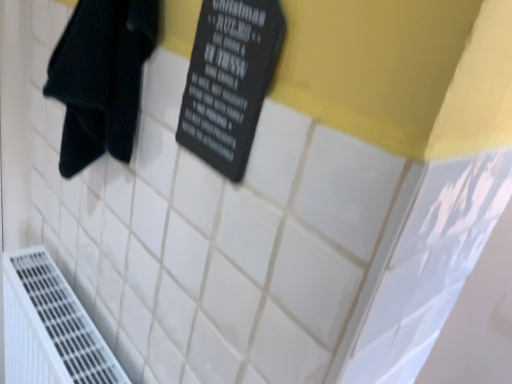
In order to face black matte sign at upper center, should I rotate leftwards or rightwards?

It's best to rotate left around 2.049 degrees.

What do you see at coordinates (229, 80) in the screenshot?
I see `black matte sign at upper center` at bounding box center [229, 80].

Find the location of a particular element. The image size is (512, 384). black matte sign at upper center is located at coordinates (229, 80).

How different are the orientations of black fabric towel at left and white plastic air conditioning at lower left in degrees?

They differ by 1.01 degrees in their facing directions.

Is black fabric towel at left positioned far away from white plastic air conditioning at lower left?

No, black fabric towel at left is not far away from white plastic air conditioning at lower left.

Relative to white plastic air conditioning at lower left, is black fabric towel at left in front or behind?

black fabric towel at left is positioned closer to the viewer than white plastic air conditioning at lower left.

Would you say black fabric towel at left contains white plastic air conditioning at lower left?

No, black fabric towel at left does not contain white plastic air conditioning at lower left.

Is black matte sign at upper center facing towards white plastic air conditioning at lower left?

No, black matte sign at upper center is not aimed at white plastic air conditioning at lower left.

Where is `bulletin board that is above the white plastic air conditioning at lower left (from a real-world perspective)`? This screenshot has width=512, height=384. bulletin board that is above the white plastic air conditioning at lower left (from a real-world perspective) is located at coordinates (229, 80).

Does black matte sign at upper center lie in front of white plastic air conditioning at lower left?

That is True.

Locate an element on the screen. towel that appears on the right of white plastic air conditioning at lower left is located at coordinates (101, 78).

Does white plastic air conditioning at lower left have a greater height compared to black fabric towel at left?

Yes, white plastic air conditioning at lower left is taller than black fabric towel at left.

Considering the relative sizes of white plastic air conditioning at lower left and black fabric towel at left in the image provided, is white plastic air conditioning at lower left smaller than black fabric towel at left?

No, white plastic air conditioning at lower left is not smaller than black fabric towel at left.

Relative to black fabric towel at left, is white plastic air conditioning at lower left in front or behind?

Clearly, white plastic air conditioning at lower left is behind black fabric towel at left.

Considering the points (78, 39) and (225, 35), which point is behind, point (78, 39) or point (225, 35)?

The point (78, 39) is behind.

Is black fabric towel at left in front of or behind black matte sign at upper center in the image?

Clearly, black fabric towel at left is behind black matte sign at upper center.

Considering the sizes of black fabric towel at left and black matte sign at upper center in the image, is black fabric towel at left wider or thinner than black matte sign at upper center?

Clearly, black fabric towel at left has more width compared to black matte sign at upper center.

Is black fabric towel at left at the left side of black matte sign at upper center?

Yes.

Considering the positions of objects black matte sign at upper center and black fabric towel at left in the image provided, who is more to the left, black matte sign at upper center or black fabric towel at left?

Positioned to the left is black fabric towel at left.

From a real-world perspective, which is physically above, black matte sign at upper center or black fabric towel at left?

In real-world perspective, black matte sign at upper center is above.

Is point (211, 163) farther from camera compared to point (149, 0)?

No, it is not.

Considering the relative sizes of black matte sign at upper center and black fabric towel at left in the image provided, is black matte sign at upper center smaller than black fabric towel at left?

A: Yes.

Is white plastic air conditioning at lower left to the right of black matte sign at upper center from the viewer's perspective?

No, white plastic air conditioning at lower left is not to the right of black matte sign at upper center.

In the scene shown: Is the surface of white plastic air conditioning at lower left in direct contact with black matte sign at upper center?

No, white plastic air conditioning at lower left is not in contact with black matte sign at upper center.

Based on the photo, could you measure the distance between white plastic air conditioning at lower left and black matte sign at upper center?

white plastic air conditioning at lower left and black matte sign at upper center are 23.20 inches apart.

From a real-world perspective, relative to black matte sign at upper center, is white plastic air conditioning at lower left vertically above or below?

In terms of real-world spatial position, white plastic air conditioning at lower left is below black matte sign at upper center.

You are a GUI agent. You are given a task and a screenshot of the screen. Output one action in this format:
    pyautogui.click(x=<x>, y=<y>)
    Task: Click on the air conditioning below the black fabric towel at left (from the image's perspective)
    The image size is (512, 384).
    Given the screenshot: What is the action you would take?
    pyautogui.click(x=50, y=327)

This screenshot has height=384, width=512. In order to click on air conditioning below the black matte sign at upper center (from a real-world perspective) in this screenshot , I will do `click(50, 327)`.

In the scene shown: From the image, which object appears to be nearer to black fabric towel at left, black matte sign at upper center or white plastic air conditioning at lower left?

black matte sign at upper center lies closer to black fabric towel at left than the other object.

When comparing their distances from black matte sign at upper center, does black fabric towel at left or white plastic air conditioning at lower left seem closer?

black fabric towel at left is closer to black matte sign at upper center.

Considering their positions, is black fabric towel at left positioned closer to white plastic air conditioning at lower left than black matte sign at upper center?

black fabric towel at left.

Which object lies nearer to the anchor point black fabric towel at left, white plastic air conditioning at lower left or black matte sign at upper center?

black matte sign at upper center.

Considering their positions, is black matte sign at upper center positioned closer to white plastic air conditioning at lower left than black fabric towel at left?

black fabric towel at left.

Estimate the real-world distances between objects in this image. Which object is closer to black matte sign at upper center, white plastic air conditioning at lower left or black fabric towel at left?

black fabric towel at left is closer to black matte sign at upper center.

Find the location of a particular element. The height and width of the screenshot is (384, 512). towel between black matte sign at upper center and white plastic air conditioning at lower left vertically is located at coordinates (101, 78).